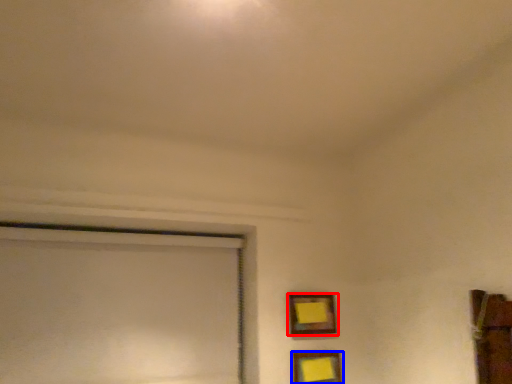
Question: Which point is further to the camera, picture frame (highlighted by a red box) or picture frame (highlighted by a blue box)?

Choices:
 (A) picture frame
 (B) picture frame

Answer: (A)